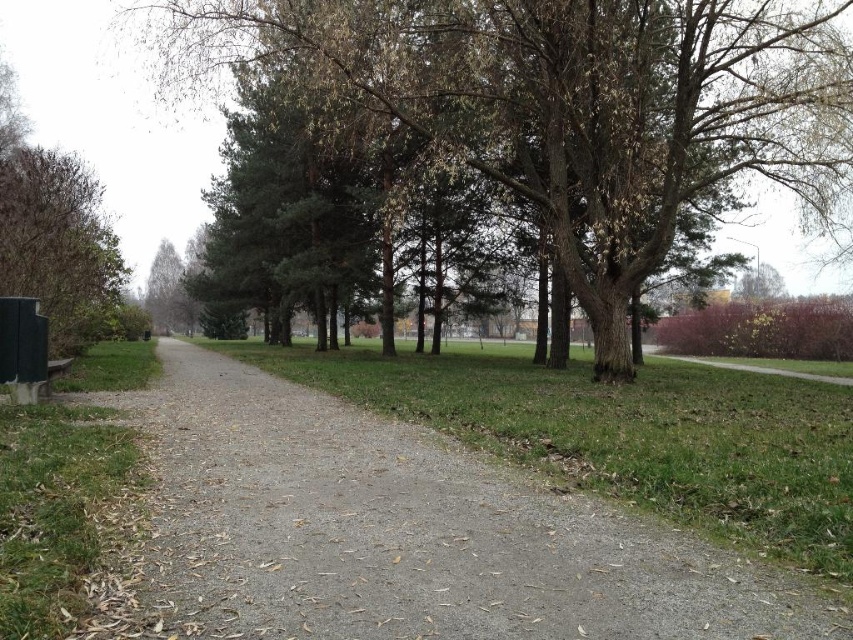
Who is taller, brown textured tree at center or brown matte tree at upper right?

brown textured tree at center

Is brown textured tree at center bigger than brown matte tree at upper right?

Yes, brown textured tree at center is bigger than brown matte tree at upper right.

The image size is (853, 640). What do you see at coordinates (567, 104) in the screenshot?
I see `brown textured tree at center` at bounding box center [567, 104].

This screenshot has height=640, width=853. Find the location of `brown textured tree at center`. brown textured tree at center is located at coordinates (567, 104).

Can you confirm if brown textured tree at center is thinner than green matte tree at upper left?

Incorrect, brown textured tree at center's width is not less than green matte tree at upper left's.

In the scene shown: Who is more forward, (602, 198) or (167, 243)?

Point (602, 198)

Identify the location of brown textured tree at center. (567, 104).

Is green grass at center to the left of green matte tree at upper left from the viewer's perspective?

In fact, green grass at center is to the right of green matte tree at upper left.

Who is more distant from viewer, (579, 465) or (172, 250)?

Point (172, 250)

I want to click on green grass at center, so click(x=627, y=435).